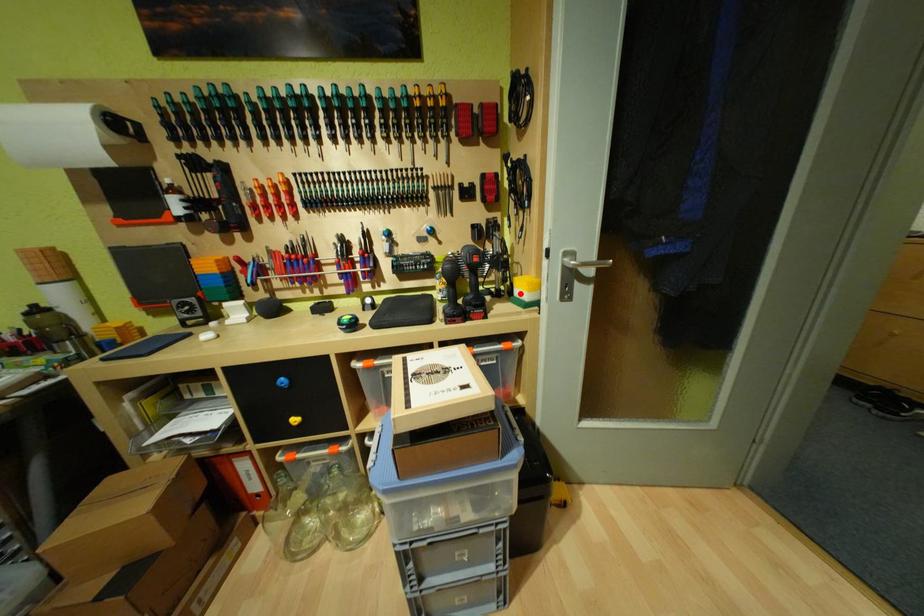
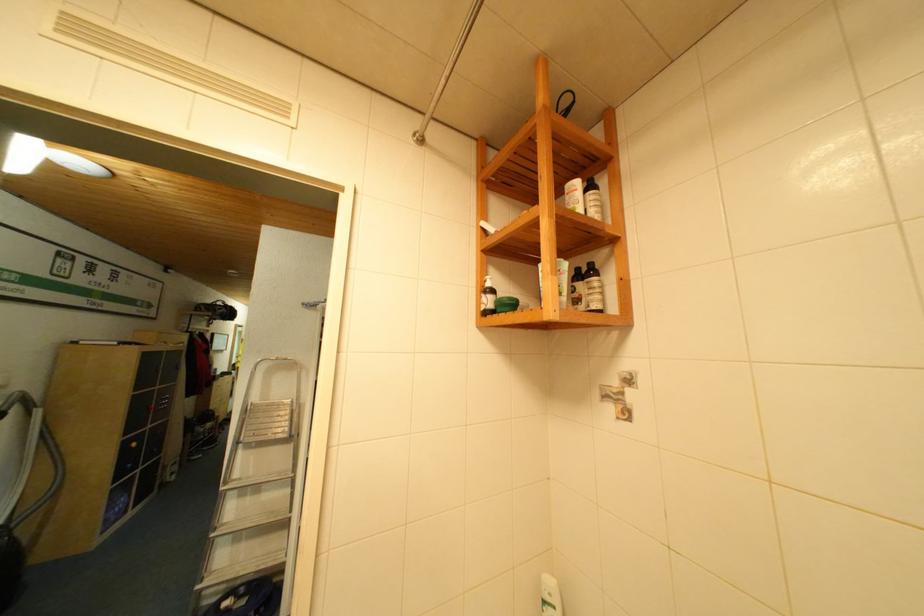
Question: I am providing you with two images of the same scene from different viewpoints. A red point is marked on the first image. At the location where the point appears in image 1, is it still visible in image 2?

Choices:
 (A) Yes
 (B) No

Answer: (B)